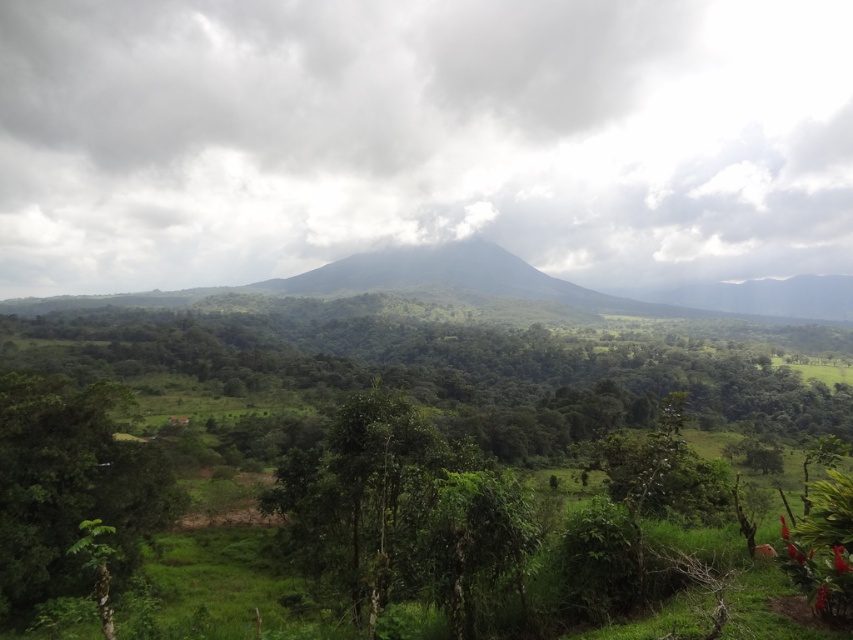
Question: Which point appears closest to the camera in this image?

Choices:
 (A) (492, 378)
 (B) (19, 452)
 (C) (704, 259)

Answer: (B)

Question: Which object is closer to the camera taking this photo?

Choices:
 (A) white fluffy cloud at upper center
 (B) green leafy tree at lower left
 (C) green leafy tree at center

Answer: (C)

Question: Is white fluffy cloud at upper center bigger than green leafy tree at lower left?

Choices:
 (A) no
 (B) yes

Answer: (B)

Question: Among these points, which one is nearest to the camera?

Choices:
 (A) (10, 563)
 (B) (296, 400)

Answer: (A)

Question: Does green leafy tree at center have a greater width compared to green leafy tree at lower left?

Choices:
 (A) yes
 (B) no

Answer: (A)

Question: In this image, where is green leafy tree at center located relative to green leafy tree at lower left?

Choices:
 (A) left
 (B) right

Answer: (A)